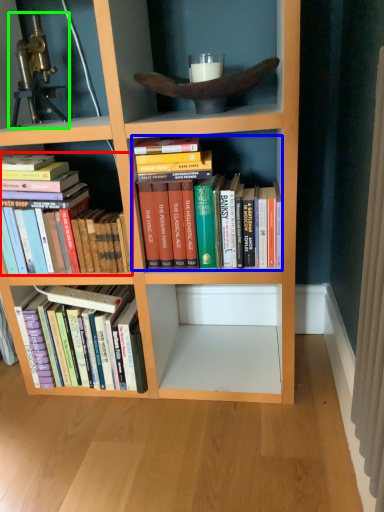
Question: Which object is the farthest from book (highlighted by a red box)? Choose among these: book (highlighted by a blue box) or telescope (highlighted by a green box).

Choices:
 (A) book
 (B) telescope

Answer: (B)